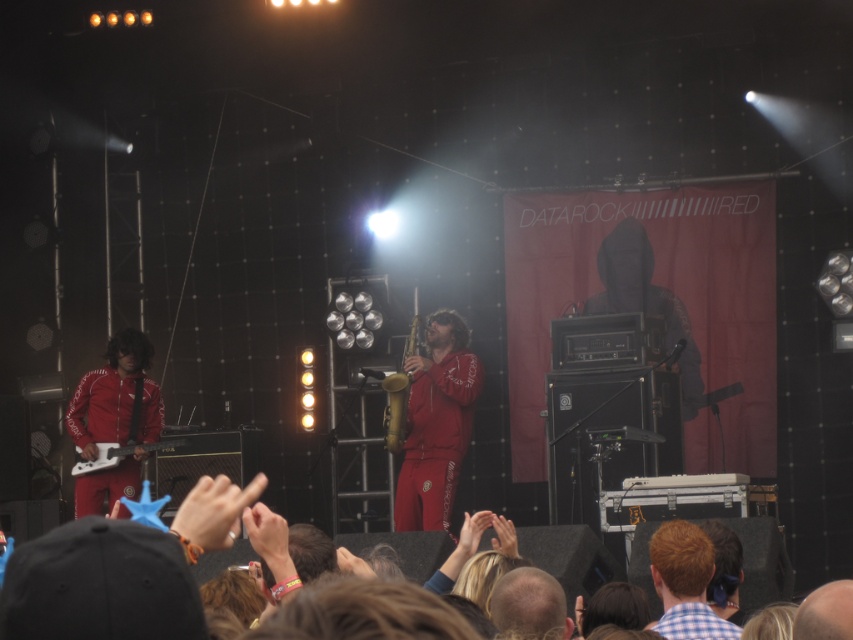
Question: Which of the following is the closest to the observer?

Choices:
 (A) (412, 436)
 (B) (86, 436)
 (C) (397, 371)

Answer: (A)

Question: Can you confirm if matte red suit at left is positioned below smooth bald head at center?

Choices:
 (A) no
 (B) yes

Answer: (A)

Question: Which of the following is the farthest from the observer?

Choices:
 (A) checkered fabric shirt at lower center
 (B) matte red tracksuit at center
 (C) smooth bald head at center

Answer: (B)

Question: Which point is closer to the camera taking this photo?

Choices:
 (A) (503, 621)
 (B) (137, 352)
 (C) (734, 630)
 (D) (384, 420)

Answer: (A)

Question: Can you confirm if matte red suit at left is positioned to the right of gold brass saxophone at center?

Choices:
 (A) no
 (B) yes

Answer: (A)

Question: Does checkered fabric shirt at lower center have a smaller size compared to smooth bald head at center?

Choices:
 (A) no
 (B) yes

Answer: (A)